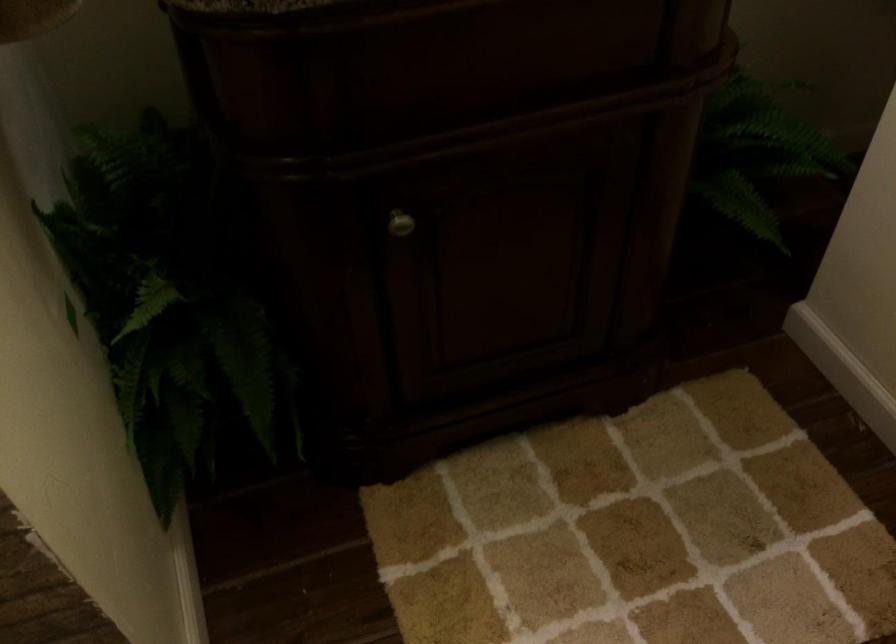
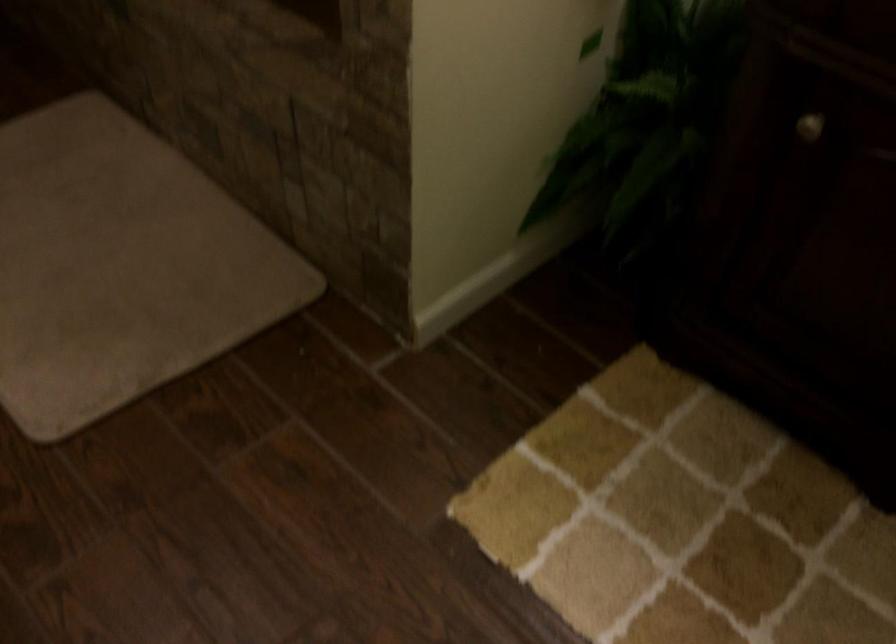
First-person continuous shooting, in which direction is the camera rotating?

The rotation direction of the camera is left-down.